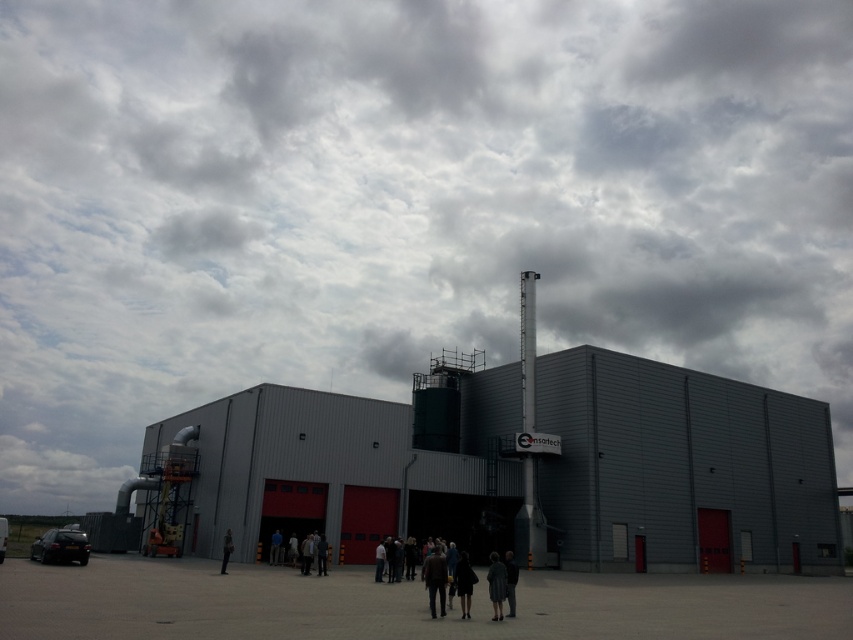
Is point (431, 564) positioned before point (511, 611)?

Yes, it is.

You are a GUI agent. You are given a task and a screenshot of the screen. Output one action in this format:
    pyautogui.click(x=<x>, y=<y>)
    Task: Click on the dark brown leather jacket at center
    
    Given the screenshot: What is the action you would take?
    pyautogui.click(x=434, y=579)

Can you confirm if dark gray coat at center is positioned below dark gray fabric dress at center?

Correct, dark gray coat at center is located below dark gray fabric dress at center.

Locate an element on the screen. dark gray coat at center is located at coordinates (496, 584).

Identify the location of dark gray coat at center. (496, 584).

Who is taller, dark gray fabric dress at center or dark gray fabric jacket at center?

Standing taller between the two is dark gray fabric dress at center.

Does dark gray fabric dress at center have a smaller size compared to dark gray fabric jacket at center?

Actually, dark gray fabric dress at center might be larger than dark gray fabric jacket at center.

Which is in front, point (508, 580) or point (223, 554)?

Point (508, 580)

At what (x,y) coordinates should I click in order to perform the action: click on dark gray fabric dress at center. Please return your answer as a coordinate pair (x, y). The height and width of the screenshot is (640, 853). Looking at the image, I should click on (509, 580).